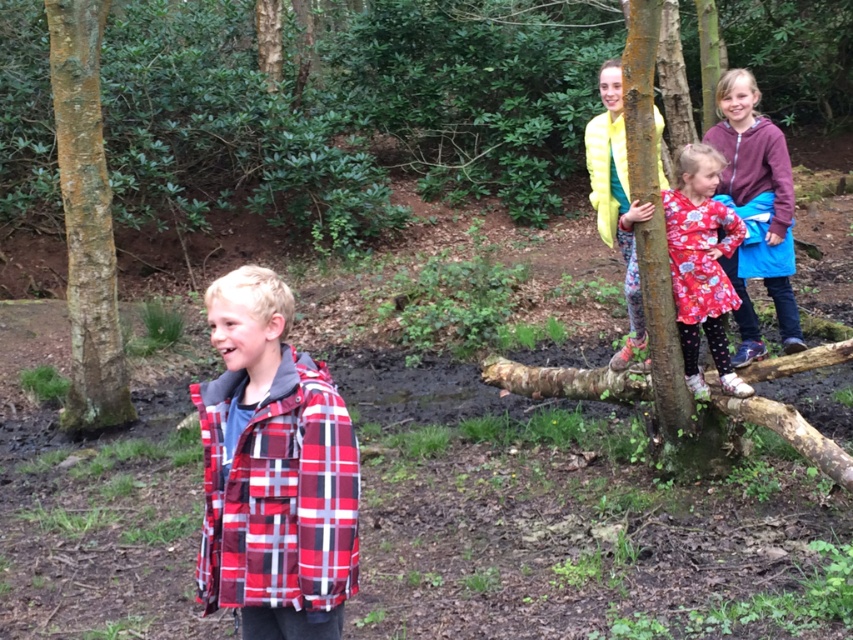
Which of these two, smooth brown bark at left or rusty wooden tree trunk at upper right, stands shorter?

With less height is rusty wooden tree trunk at upper right.

From the picture: Which of these two, smooth brown bark at left or rusty wooden tree trunk at upper right, stands taller?

With more height is smooth brown bark at left.

Who is more distant from viewer, (119, 353) or (614, 362)?

The point (119, 353) is behind.

Where is `smooth brown bark at left`? The image size is (853, 640). smooth brown bark at left is located at coordinates (86, 221).

Who is more distant from viewer, (x=776, y=156) or (x=634, y=310)?

Positioned behind is point (x=634, y=310).

Is floral dress at upper right to the left of rusty wooden tree trunk at upper right from the viewer's perspective?

Incorrect, floral dress at upper right is not on the left side of rusty wooden tree trunk at upper right.

Describe the element at coordinates (756, 211) in the screenshot. Image resolution: width=853 pixels, height=640 pixels. I see `floral dress at upper right` at that location.

I want to click on floral dress at upper right, so click(756, 211).

Does smooth brown bark at left have a larger size compared to floral dress at upper right?

Correct, smooth brown bark at left is larger in size than floral dress at upper right.

Does smooth brown bark at left have a lesser width compared to floral dress at upper right?

Indeed, smooth brown bark at left has a lesser width compared to floral dress at upper right.

This screenshot has width=853, height=640. In order to click on smooth brown bark at left in this screenshot , I will do `click(86, 221)`.

Where is `smooth brown bark at left`? The width and height of the screenshot is (853, 640). smooth brown bark at left is located at coordinates (86, 221).